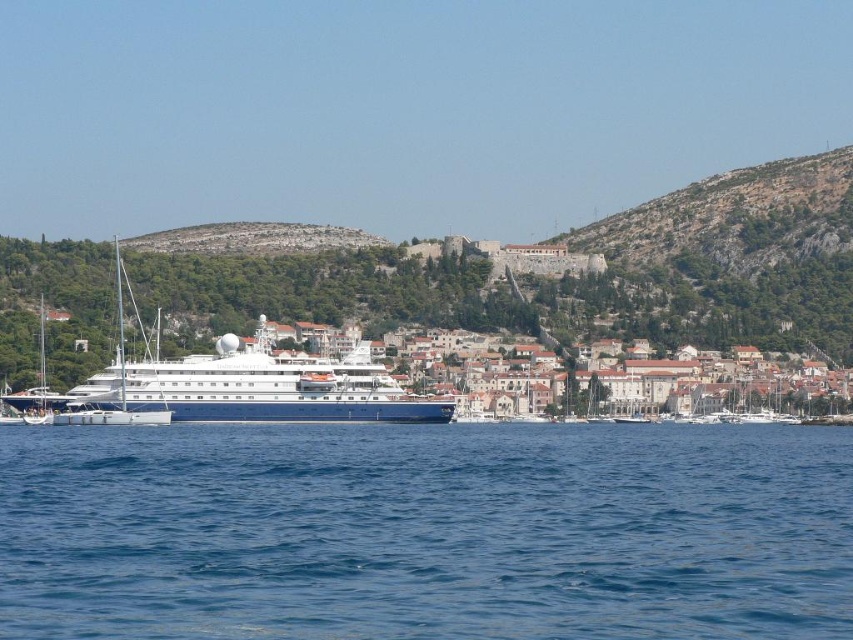
You are a photographer planning to capture the cruise ship and the water in the scene. Based on the image, which object, the blue liquid water at center or the white glossy cruise ship at center, appears taller in the photograph?

The white glossy cruise ship at center appears taller than the blue liquid water at center in the photograph.